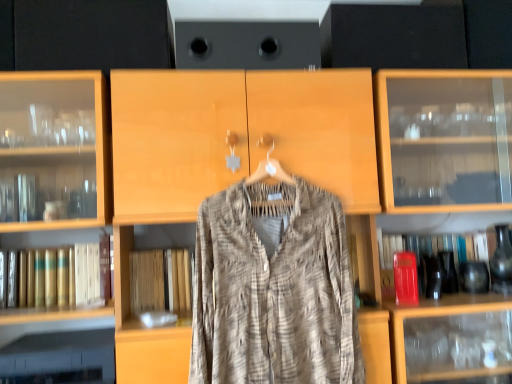
The height and width of the screenshot is (384, 512). Describe the element at coordinates (273, 289) in the screenshot. I see `textured beige shirt at center` at that location.

Where is `red matte book at right, the 1th book positioned from the right`? This screenshot has width=512, height=384. red matte book at right, the 1th book positioned from the right is located at coordinates (436, 255).

Locate an element on the screen. This screenshot has height=384, width=512. textured beige shirt at center is located at coordinates (273, 289).

From a real-world perspective, does gold leather book at left, which is counted as the first book, starting from the left, sit lower than textured beige shirt at center?

Yes.

Does gold leather book at left, the second book from the right, have a smaller size compared to textured beige shirt at center?

Correct, gold leather book at left, the second book from the right, occupies less space than textured beige shirt at center.

Does point (101, 241) come behind point (194, 321)?

Yes, it is.

Does point (32, 269) come in front of point (436, 243)?

That is True.

Can we say gold leather book at left, which is counted as the first book, starting from the left, lies outside red matte book at right, the 1th book positioned from the right?

Yes.

From a real-world perspective, which is physically above, gold leather book at left, which is counted as the first book, starting from the left, or red matte book at right, the second book positioned from the left?

In real-world perspective, gold leather book at left, which is counted as the first book, starting from the left, is above.

Is textured beige shirt at center outside of gold leather book at left, which is counted as the first book, starting from the left?

That's correct, textured beige shirt at center is outside of gold leather book at left, which is counted as the first book, starting from the left.

What are the coordinates of `fancy dress on the right of gold leather book at left, which is counted as the first book, starting from the left` in the screenshot? It's located at (273, 289).

Is textured beige shirt at center turned away from gold leather book at left, which is counted as the first book, starting from the left?

No, textured beige shirt at center is not facing the opposite direction of gold leather book at left, which is counted as the first book, starting from the left.

From the image's perspective, is textured beige shirt at center above or below gold leather book at left, which is counted as the first book, starting from the left?

From the image's perspective, textured beige shirt at center appears above gold leather book at left, which is counted as the first book, starting from the left.

In terms of height, does textured beige shirt at center look taller or shorter compared to red matte book at right, the second book positioned from the left?

In the image, textured beige shirt at center appears to be taller than red matte book at right, the second book positioned from the left.

Looking at this image, which is more to the right, textured beige shirt at center or red matte book at right, the 1th book positioned from the right?

red matte book at right, the 1th book positioned from the right, is more to the right.

From a real-world perspective, is textured beige shirt at center physically above red matte book at right, the 1th book positioned from the right?

Yes, from a real-world perspective, textured beige shirt at center is above red matte book at right, the 1th book positioned from the right.

Can you confirm if red matte book at right, the 1th book positioned from the right, is bigger than gold leather book at left, which is counted as the first book, starting from the left?

Yes.

Is red matte book at right, the 1th book positioned from the right, completely or partially outside of gold leather book at left, which is counted as the first book, starting from the left?

A: red matte book at right, the 1th book positioned from the right, is positioned outside gold leather book at left, which is counted as the first book, starting from the left.

Is red matte book at right, the second book positioned from the left, turned away from gold leather book at left, the second book from the right?

No, red matte book at right, the second book positioned from the left, is not facing away from gold leather book at left, the second book from the right.

Can you confirm if red matte book at right, the 1th book positioned from the right, is wider than gold leather book at left, the second book from the right?

Indeed, red matte book at right, the 1th book positioned from the right, has a greater width compared to gold leather book at left, the second book from the right.

From a real-world perspective, which is physically above, red matte book at right, the 1th book positioned from the right, or textured beige shirt at center?

textured beige shirt at center.

Which is more to the right, red matte book at right, the second book positioned from the left, or textured beige shirt at center?

From the viewer's perspective, red matte book at right, the second book positioned from the left, appears more on the right side.

How distant is red matte book at right, the 1th book positioned from the right, from textured beige shirt at center?

red matte book at right, the 1th book positioned from the right, is 17.78 inches away from textured beige shirt at center.

Considering the sizes of objects red matte book at right, the second book positioned from the left, and textured beige shirt at center in the image provided, who is wider, red matte book at right, the second book positioned from the left, or textured beige shirt at center?

red matte book at right, the second book positioned from the left, is wider.

Where is `fancy dress lying above the gold leather book at left, the second book from the right (from the image's perspective)`? The height and width of the screenshot is (384, 512). fancy dress lying above the gold leather book at left, the second book from the right (from the image's perspective) is located at coordinates (273, 289).

At what (x,y) coordinates should I click in order to perform the action: click on book lying in front of the red matte book at right, the second book positioned from the left. Please return your answer as a coordinate pair (x, y). Looking at the image, I should click on (58, 276).

Based on their spatial positions, is gold leather book at left, which is counted as the first book, starting from the left, or textured beige shirt at center closer to red matte book at right, the second book positioned from the left?

textured beige shirt at center is closer to red matte book at right, the second book positioned from the left.

When comparing their distances from gold leather book at left, the second book from the right, does textured beige shirt at center or red matte book at right, the second book positioned from the left, seem closer?

Among the two, textured beige shirt at center is located nearer to gold leather book at left, the second book from the right.

Looking at the image, which one is located closer to gold leather book at left, the second book from the right, red matte book at right, the 1th book positioned from the right, or textured beige shirt at center?

The object closer to gold leather book at left, the second book from the right, is textured beige shirt at center.

When comparing their distances from red matte book at right, the second book positioned from the left, does textured beige shirt at center or gold leather book at left, which is counted as the first book, starting from the left, seem closer?

The object closer to red matte book at right, the second book positioned from the left, is textured beige shirt at center.

Consider the image. Based on their spatial positions, is gold leather book at left, which is counted as the first book, starting from the left, or red matte book at right, the 1th book positioned from the right, further from textured beige shirt at center?

gold leather book at left, which is counted as the first book, starting from the left.

Estimate the real-world distances between objects in this image. Which object is closer to textured beige shirt at center, red matte book at right, the 1th book positioned from the right, or gold leather book at left, which is counted as the first book, starting from the left?

The object closer to textured beige shirt at center is red matte book at right, the 1th book positioned from the right.

At what (x,y) coordinates should I click in order to perform the action: click on fancy dress between gold leather book at left, which is counted as the first book, starting from the left, and red matte book at right, the second book positioned from the left, from left to right. Please return your answer as a coordinate pair (x, y). Looking at the image, I should click on (273, 289).